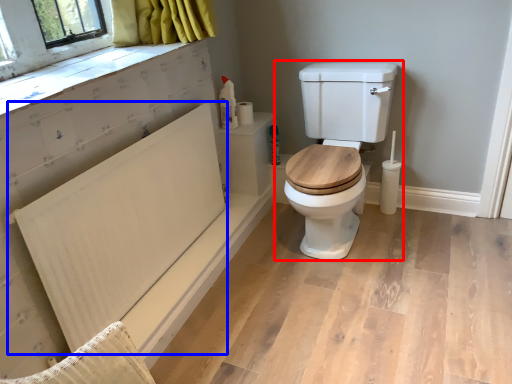
Question: Which of the following is the closest to the observer, toilet (highlighted by a red box) or radiator (highlighted by a blue box)?

Choices:
 (A) toilet
 (B) radiator

Answer: (B)